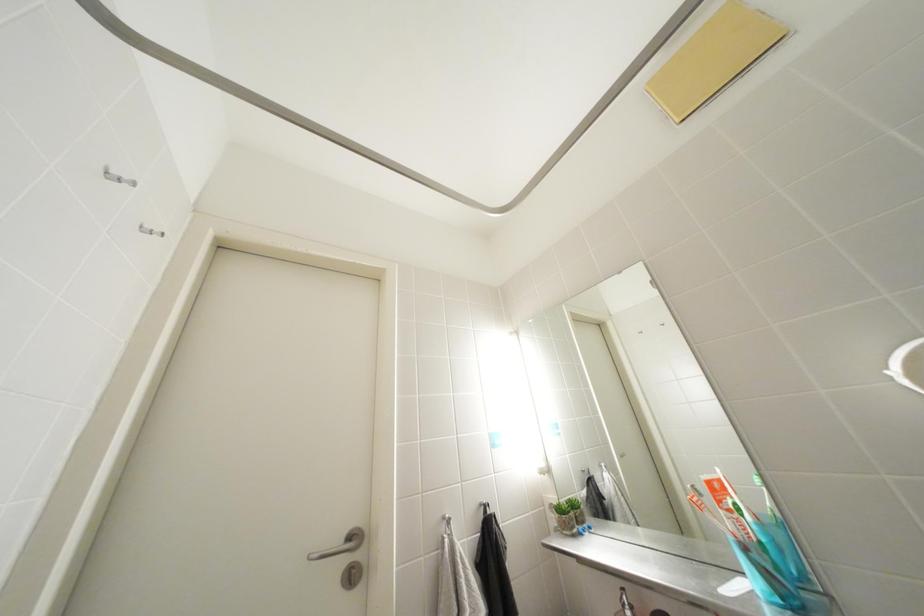
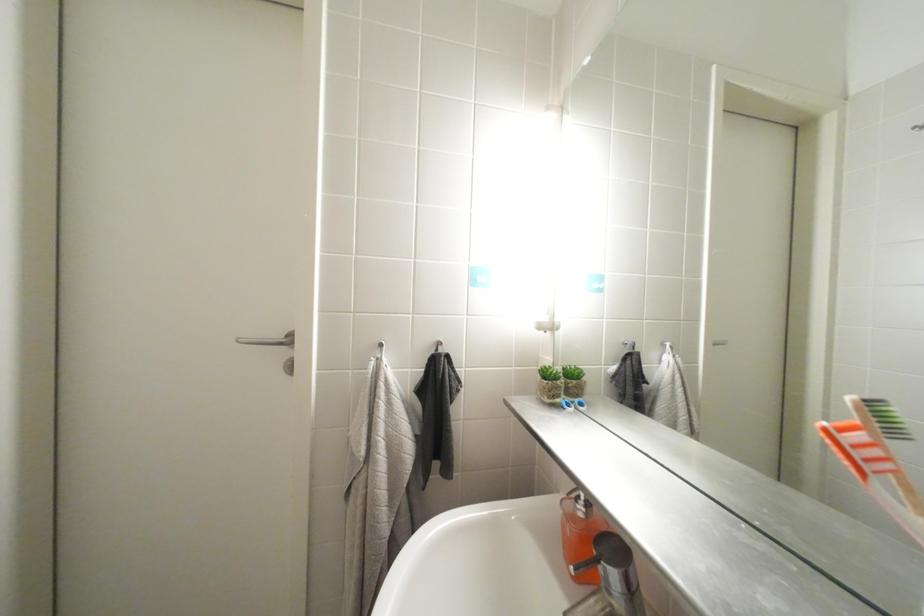
Consider the image. Based on the continuous images, in which direction is the camera rotating?

The camera rotated toward left-down.